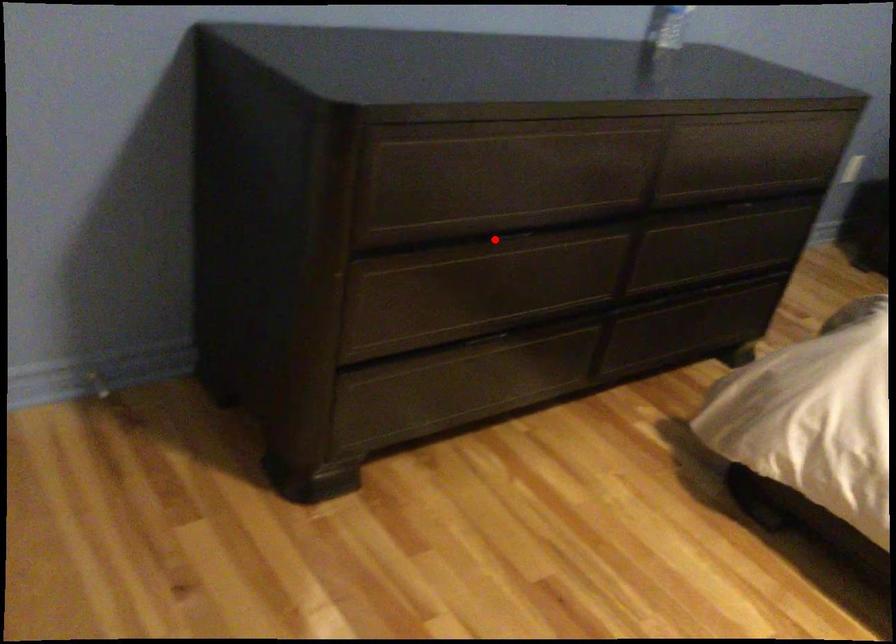
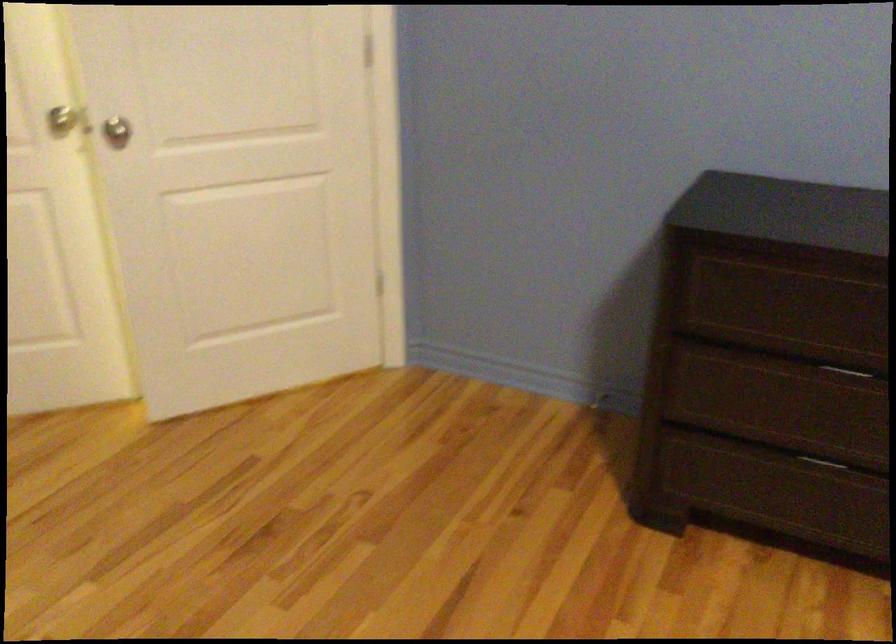
Locate, in the second image, the point that corresponds to the highlighted location in the first image.

(850, 371)